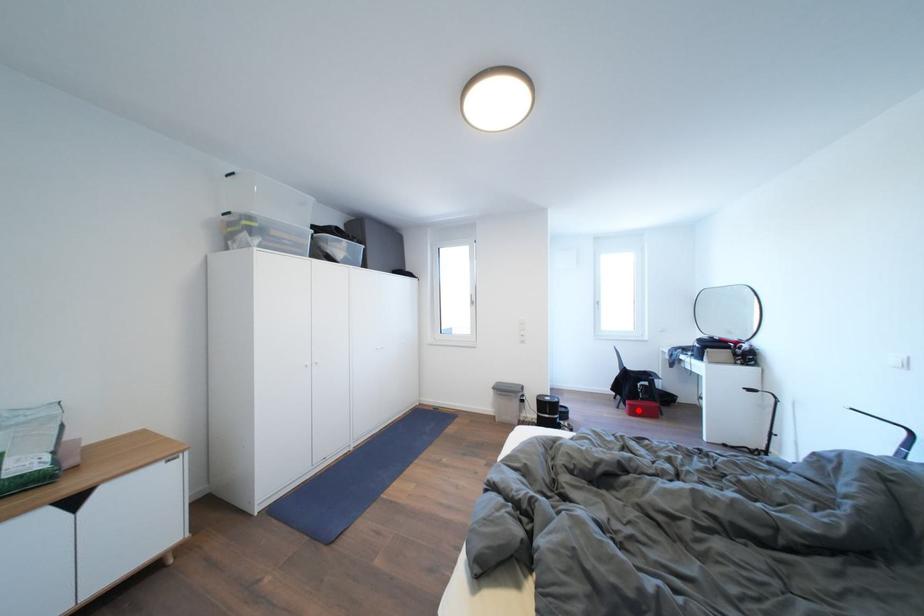
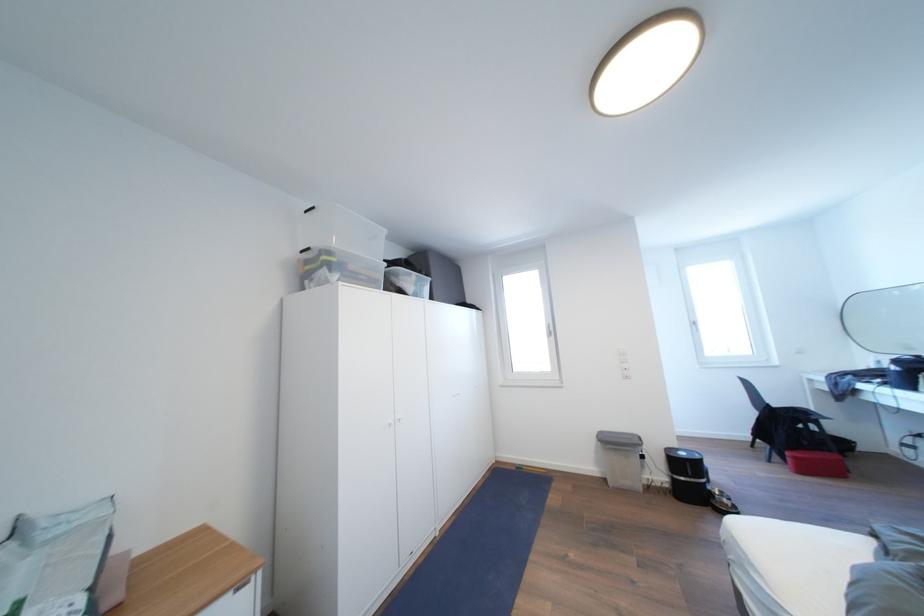
Find the pixel in the second image that matches the highlighted location in the first image.

(803, 463)